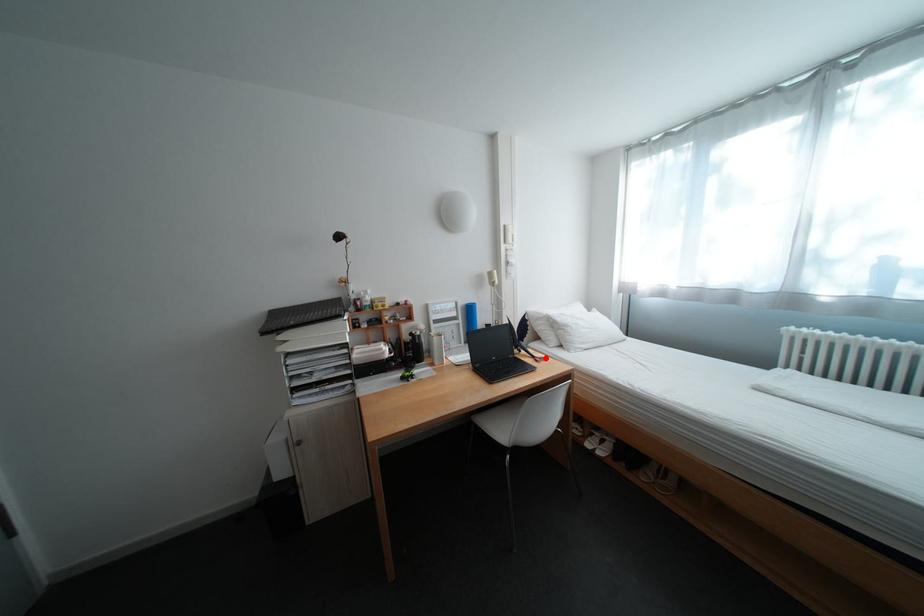
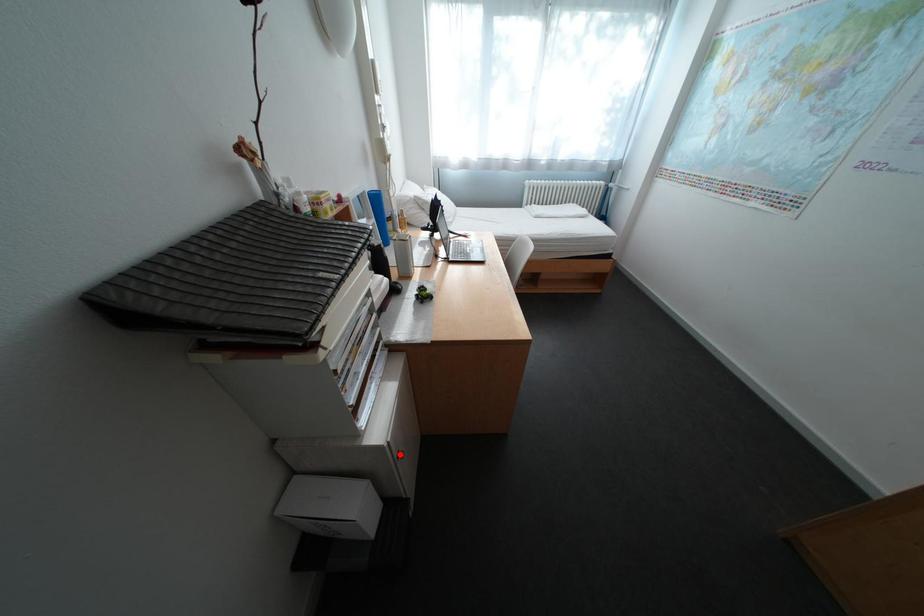
I am providing you with two images of the same scene from different viewpoints. A red point is marked on the first image and another point is marked on the second image. Are the points marked in image1 and image2 representing the same 3D position?

No